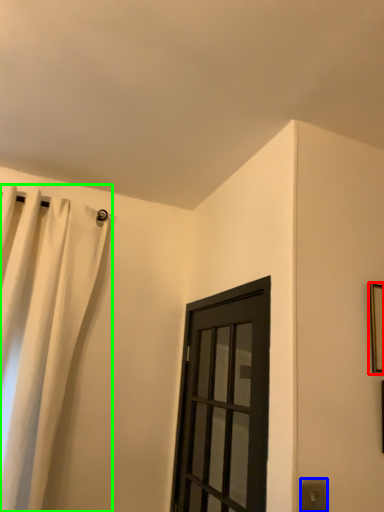
Question: Which object is the closest to the picture frame (highlighted by a red box)? Choose among these: electric outlet (highlighted by a blue box) or curtain (highlighted by a green box).

Choices:
 (A) electric outlet
 (B) curtain

Answer: (A)